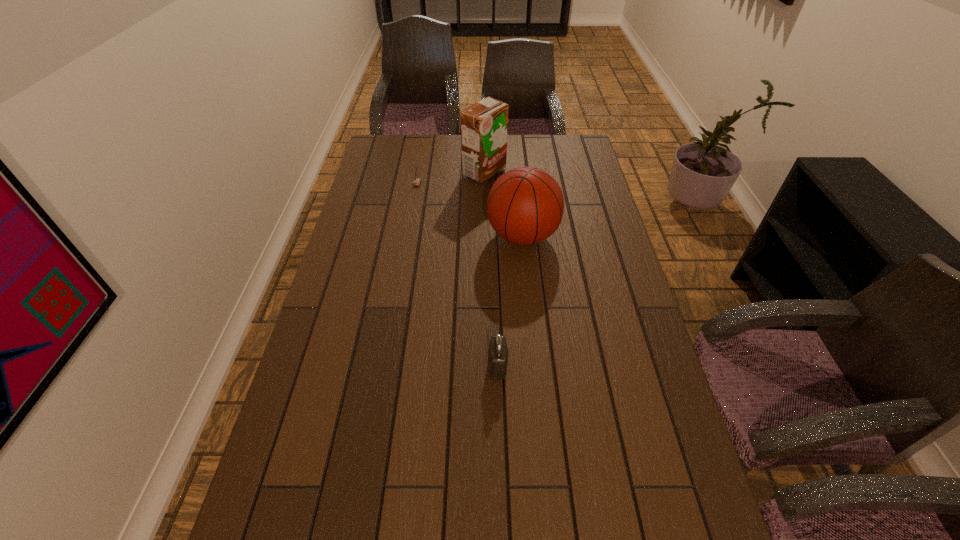
The image size is (960, 540). I want to click on free space located 0.160m at the front of the third tallest object near the keyhole, so click(425, 365).

You are a GUI agent. You are given a task and a screenshot of the screen. Output one action in this format:
    pyautogui.click(x=<x>, y=<y>)
    Task: Click on the vacant space located 0.140m at the front of the third tallest object near the keyhole
    
    Given the screenshot: What is the action you would take?
    pyautogui.click(x=433, y=365)

The height and width of the screenshot is (540, 960). I want to click on free spot located 0.360m at the front of the third tallest object near the keyhole, so click(x=348, y=365).

I want to click on vacant space located 0.230m on the back of the matchbox, so [x=422, y=149].

Identify the location of object present at the far edge. The image size is (960, 540). (484, 125).

At what (x,y) coordinates should I click in order to perform the action: click on vacant space at the far edge of the desktop. Please return your answer as a coordinate pair (x, y). The height and width of the screenshot is (540, 960). Looking at the image, I should click on (459, 147).

Find the location of a particular element. The width and height of the screenshot is (960, 540). vacant space at the left edge of the desktop is located at coordinates (335, 469).

In the image, there is a desktop. Where is `free space at the right edge`? The width and height of the screenshot is (960, 540). free space at the right edge is located at coordinates (593, 201).

Find the location of `vacant area at the far left corner`. vacant area at the far left corner is located at coordinates (385, 164).

Find the location of a particular element. empty space between the second nearest object and the second shortest object is located at coordinates (510, 301).